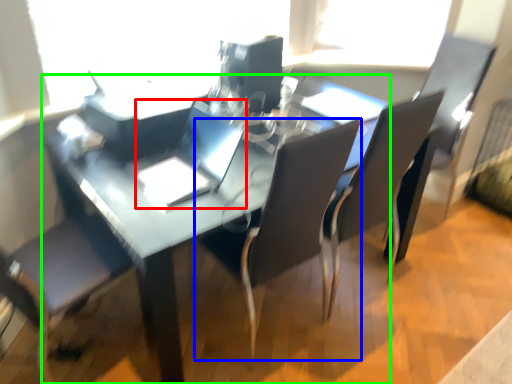
Question: Based on their relative distances, which object is nearer to laptop (highlighted by a red box)? Choose from chair (highlighted by a blue box) and table (highlighted by a green box).

Choices:
 (A) chair
 (B) table

Answer: (B)